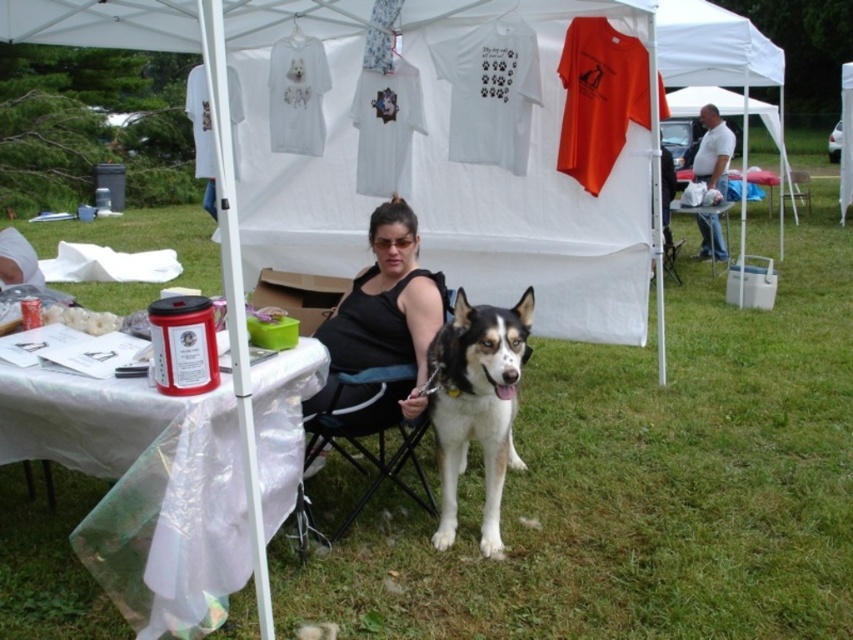
Is white plastic table at center taller than metallic silver chair at center?

No, white plastic table at center is not taller than metallic silver chair at center.

Does white plastic table at center have a smaller size compared to metallic silver chair at center?

Indeed, white plastic table at center has a smaller size compared to metallic silver chair at center.

Between point (669, 204) and point (805, 180), which one is positioned behind?

Positioned behind is point (805, 180).

Find the location of a particular element. The width and height of the screenshot is (853, 640). white plastic table at center is located at coordinates (704, 209).

Where is `white plastic table at lower left`? white plastic table at lower left is located at coordinates (142, 486).

Who is higher up, white plastic table at lower left or black fabric chair at center?

white plastic table at lower left is above.

The height and width of the screenshot is (640, 853). What do you see at coordinates (142, 486) in the screenshot?
I see `white plastic table at lower left` at bounding box center [142, 486].

Locate an element on the screen. This screenshot has width=853, height=640. white plastic table at lower left is located at coordinates (142, 486).

Can you confirm if white fur dog at center is smaller than metallic silver chair at center?

Indeed, white fur dog at center has a smaller size compared to metallic silver chair at center.

This screenshot has width=853, height=640. In order to click on white fur dog at center in this screenshot , I will do `click(477, 404)`.

I want to click on white fur dog at center, so click(x=477, y=404).